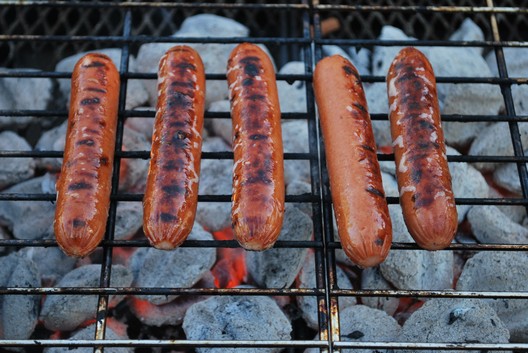
What are the coordinates of `rack` in the screenshot? It's located at (316, 298).